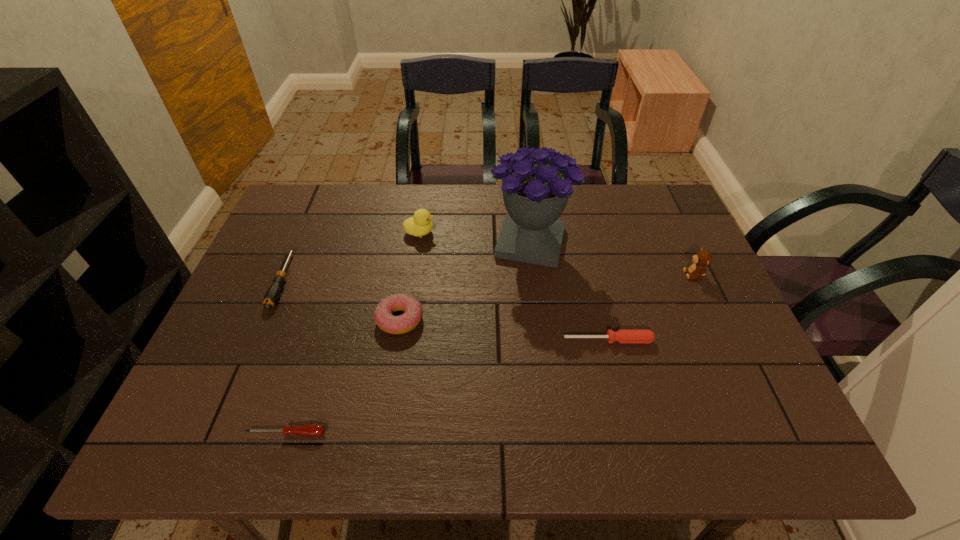
Where is `vacant space that's between the duckling and the sixth tallest object`? vacant space that's between the duckling and the sixth tallest object is located at coordinates (514, 286).

Where is `object that stands as the third closest to the rightmost screwdriver`? The width and height of the screenshot is (960, 540). object that stands as the third closest to the rightmost screwdriver is located at coordinates (413, 311).

You are a GUI agent. You are given a task and a screenshot of the screen. Output one action in this format:
    pyautogui.click(x=<x>, y=<y>)
    Task: Click on the object that is the fourth closest one to the second farthest screwdriver
    
    Given the screenshot: What is the action you would take?
    pyautogui.click(x=420, y=224)

Identify which screwdriver is the second nearest to the leftmost screwdriver. Please provide its 2D coordinates. Your answer should be formatted as a tuple, i.e. [(x, y)], where the tuple contains the x and y coordinates of a point satisfying the conditions above.

[(623, 335)]

Choose which screwdriver is the nearest neighbor to the leftmost object. Please provide its 2D coordinates. Your answer should be formatted as a tuple, i.e. [(x, y)], where the tuple contains the x and y coordinates of a point satisfying the conditions above.

[(311, 430)]

At what (x,y) coordinates should I click in order to perform the action: click on free space that satisfies the following two spatial constraints: 1. on the face of the teddy bear; 2. on the front side of the leftmost object. Please return your answer as a coordinate pair (x, y). Looking at the image, I should click on (696, 280).